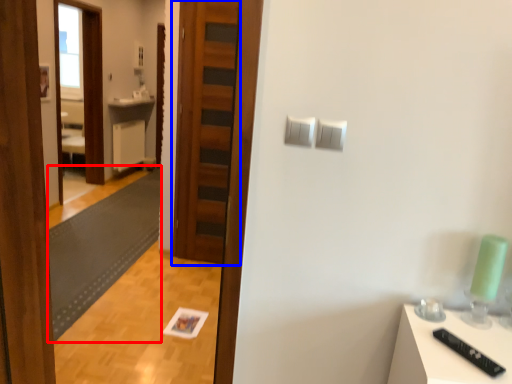
Question: Which point is closer to the camera, mat (highlighted by a red box) or door (highlighted by a blue box)?

Choices:
 (A) mat
 (B) door

Answer: (A)